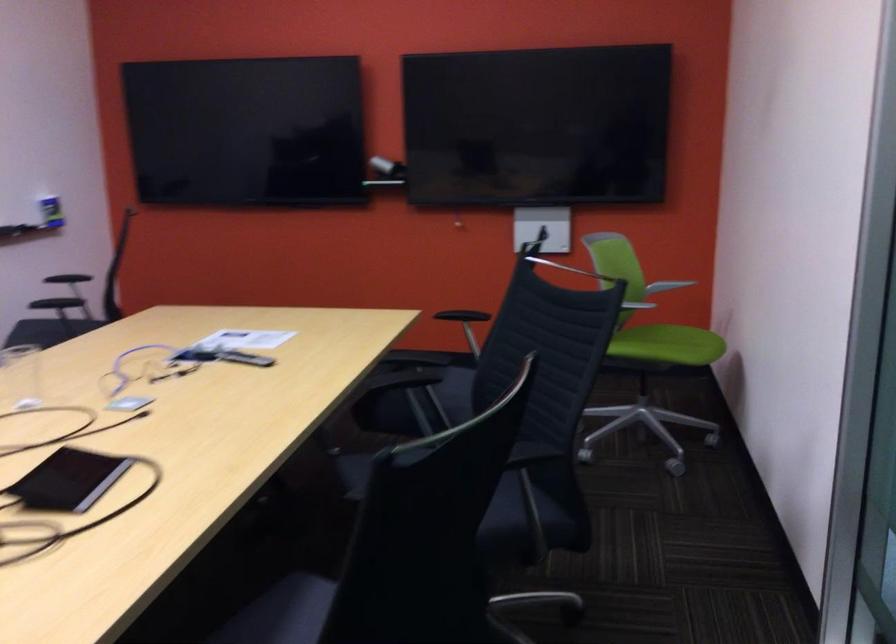
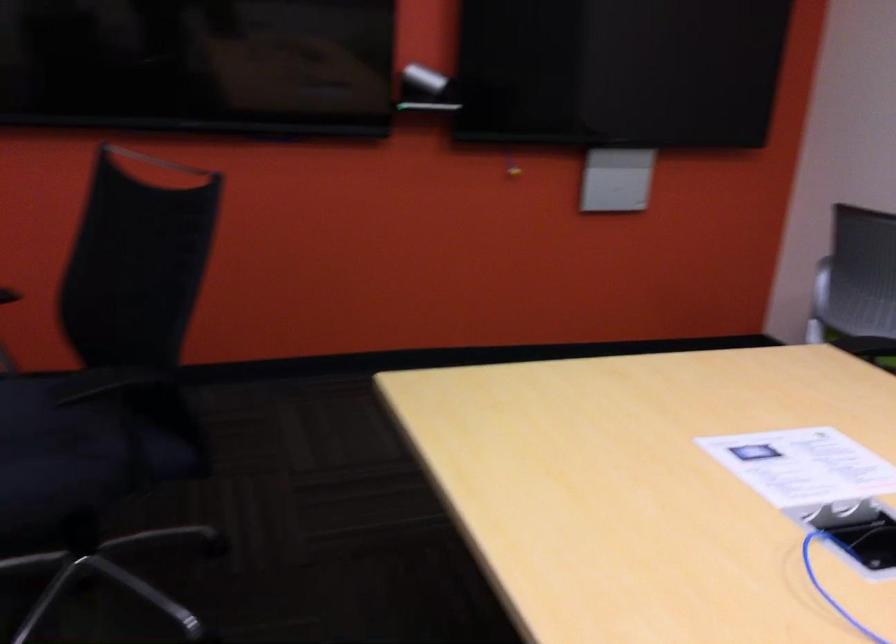
The point at [244,357] is marked in the first image. Where is the corresponding point in the second image?

(858, 532)